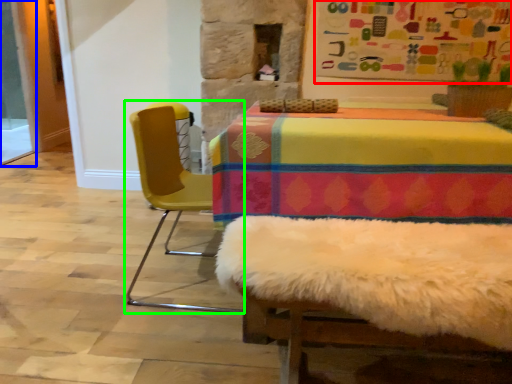
Question: Which is farther away from bulletin board (highlighted by a red box)? screen door (highlighted by a blue box) or chair (highlighted by a green box)?

Choices:
 (A) screen door
 (B) chair

Answer: (A)